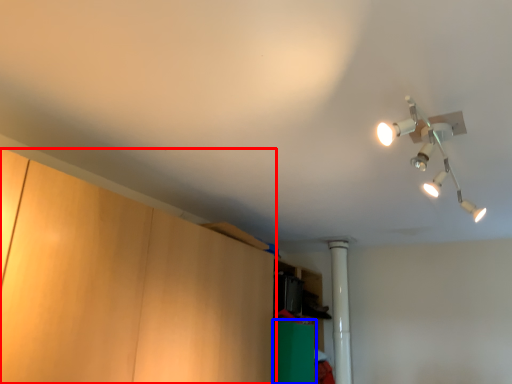
Question: Among these objects, which one is farthest to the camera, cabinetry (highlighted by a red box) or cabinetry (highlighted by a blue box)?

Choices:
 (A) cabinetry
 (B) cabinetry

Answer: (B)